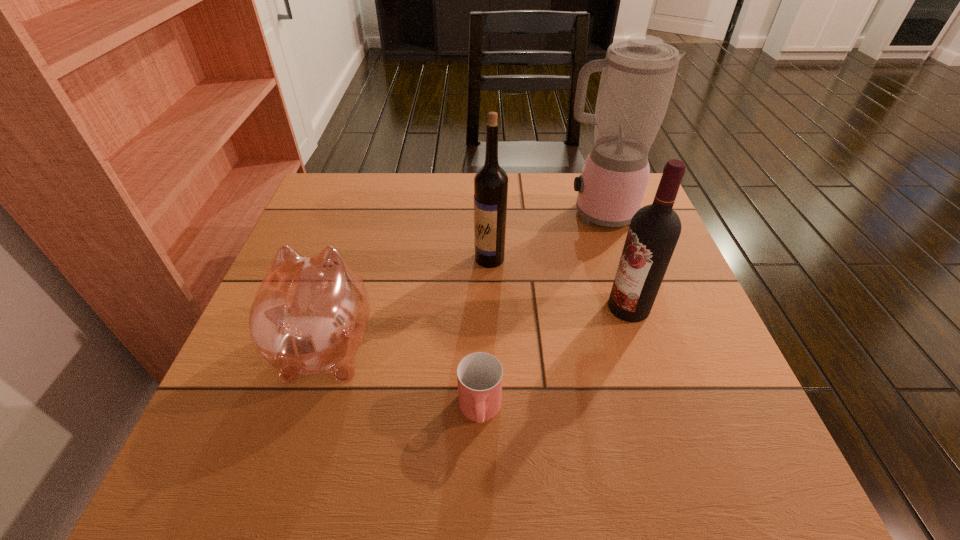
This screenshot has height=540, width=960. Identify the location of vacant region located 0.060m on the side of the cup with the handle. (480, 478).

The width and height of the screenshot is (960, 540). In order to click on object present at the far edge in this screenshot , I will do `click(638, 74)`.

Locate an element on the screen. Image resolution: width=960 pixels, height=540 pixels. object present at the near edge is located at coordinates (479, 375).

The width and height of the screenshot is (960, 540). I want to click on object that is at the left edge, so click(x=309, y=316).

Locate an element on the screen. Image resolution: width=960 pixels, height=540 pixels. food processor present at the right edge is located at coordinates (638, 74).

At what (x,y) coordinates should I click in order to perform the action: click on wine bottle that is at the right edge. Please return your answer as a coordinate pair (x, y). Image resolution: width=960 pixels, height=540 pixels. Looking at the image, I should click on (654, 230).

Where is `object that is positioned at the far right corner`? This screenshot has height=540, width=960. object that is positioned at the far right corner is located at coordinates (638, 74).

In the image, there is a desktop. At what (x,y) coordinates should I click in order to perform the action: click on vacant space at the far edge. Please return your answer as a coordinate pair (x, y). Image resolution: width=960 pixels, height=540 pixels. Looking at the image, I should click on (432, 192).

Find the location of a particular element. The width and height of the screenshot is (960, 540). vacant space at the left edge is located at coordinates (296, 240).

Where is `blank area at the right edge`? Image resolution: width=960 pixels, height=540 pixels. blank area at the right edge is located at coordinates (673, 431).